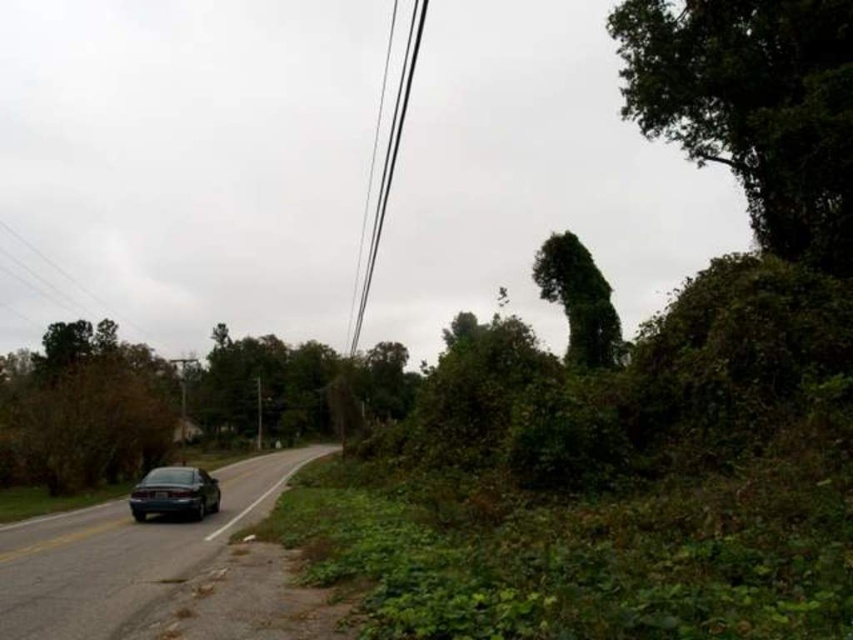
Question: Which of the following is the farthest from the observer?

Choices:
 (A) (212, 508)
 (B) (572, 268)

Answer: (B)

Question: Which of the following is the farthest from the observer?

Choices:
 (A) pos(715,12)
 (B) pos(189,481)
 (C) pos(578,276)
 (D) pos(151,458)

Answer: (C)

Question: Is black wire at upper center further to the viewer compared to shiny dark green sedan at lower left?

Choices:
 (A) no
 (B) yes

Answer: (B)

Question: Which is farther from the shiny dark green sedan at lower left?

Choices:
 (A) green leafy tree at upper right
 (B) green leafy tree at left
 (C) green leafy tree at upper center
 (D) black wire at upper center

Answer: (D)

Question: Does green leafy tree at upper right appear under green leafy tree at upper center?

Choices:
 (A) yes
 (B) no

Answer: (B)

Question: Is green leafy tree at upper center below shiny dark green sedan at lower left?

Choices:
 (A) yes
 (B) no

Answer: (B)